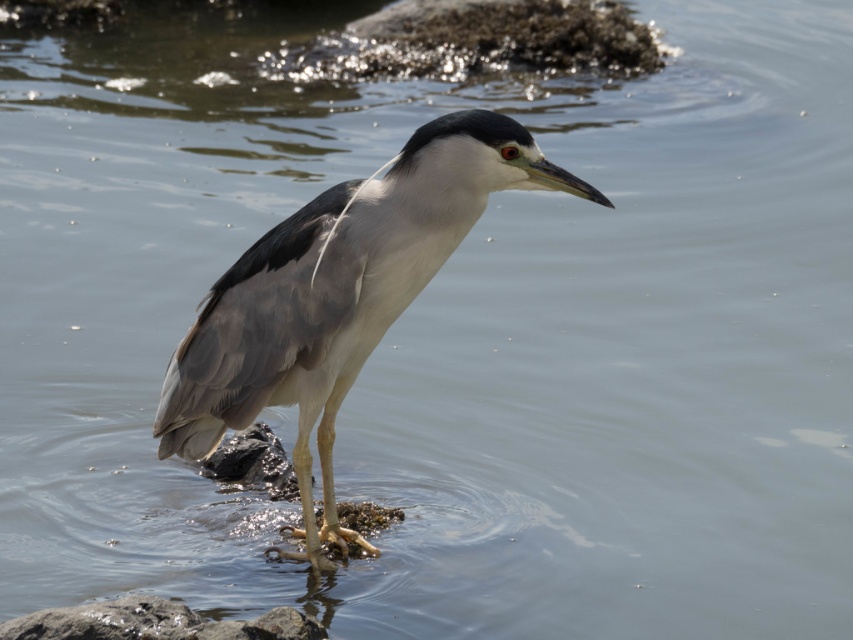
You are a wildlife photographer aiming to capture the gray matte bird at center and the smooth gray rock at lower left in the same frame. Based on their sizes, which object should you focus on first to ensure both fit in the shot?

The gray matte bird at center is larger than the smooth gray rock at lower left, so you should focus on the gray matte bird at center first to ensure both fit in the shot.

You are a birdwatcher trying to observe the gray matte bird at center and the smooth gray rock at lower left. Which object is closer to your observation point?

The gray matte bird at center is closer to the observer because it is positioned further to the viewer than the smooth gray rock at lower left, meaning it appears nearer in the scene.

You are a birdwatcher observing the scene from the shore. You notice the gray matte bird at center and the smooth gray rock at lower left. Which object is positioned higher in the image?

The gray matte bird at center is above the smooth gray rock at lower left, so it is positioned higher in the image.